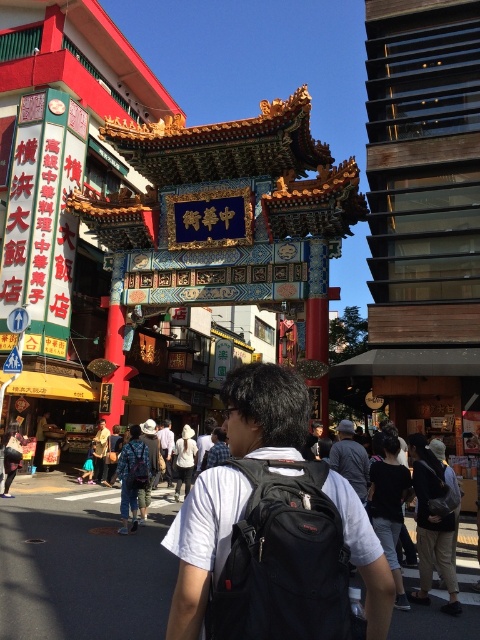
You are a fashion designer observing a street scene in Chinatown. You notice a light brown leather jacket at center and a white shirt at center. Which clothing item appears smaller in size?

The light brown leather jacket at center is smaller than the white shirt at center.